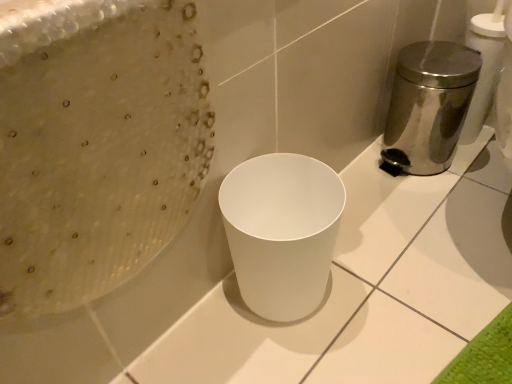
Locate an element on the screen. Image resolution: width=512 pixels, height=384 pixels. free space in front of polished stainless steel trash can at right is located at coordinates (414, 205).